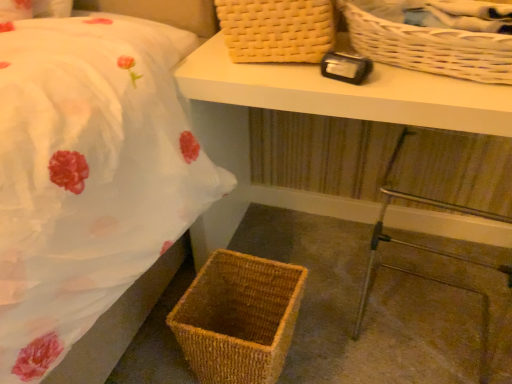
Question: Does woven wicker basket at lower left have a lesser width compared to woven wood table at center?

Choices:
 (A) yes
 (B) no

Answer: (B)

Question: Is woven wicker basket at lower left outside woven wood table at center?

Choices:
 (A) yes
 (B) no

Answer: (A)

Question: Is woven wicker basket at lower left taller than woven wood table at center?

Choices:
 (A) yes
 (B) no

Answer: (B)

Question: Is woven wicker basket at lower left bigger than woven wood table at center?

Choices:
 (A) no
 (B) yes

Answer: (A)

Question: Considering the relative sizes of woven wicker basket at lower left and woven wood table at center in the image provided, is woven wicker basket at lower left smaller than woven wood table at center?

Choices:
 (A) yes
 (B) no

Answer: (A)

Question: Is woven wood table at center located within woven wicker basket at lower left?

Choices:
 (A) yes
 (B) no

Answer: (B)

Question: Is woven beige picnic basket at upper center, which appears as the third picnic basket when ordered from the bottom, surrounded by metallic silver step stool at lower right?

Choices:
 (A) no
 (B) yes

Answer: (A)

Question: From the image's perspective, is metallic silver step stool at lower right over woven beige picnic basket at upper center, which appears as the third picnic basket when ordered from the bottom?

Choices:
 (A) no
 (B) yes

Answer: (A)

Question: Is metallic silver step stool at lower right to the left of woven beige picnic basket at upper center, arranged as the first picnic basket when viewed from the top, from the viewer's perspective?

Choices:
 (A) yes
 (B) no

Answer: (B)

Question: Is metallic silver step stool at lower right facing towards woven beige picnic basket at upper center, arranged as the first picnic basket when viewed from the top?

Choices:
 (A) yes
 (B) no

Answer: (B)

Question: Is the position of metallic silver step stool at lower right less distant than that of woven beige picnic basket at upper center, arranged as the first picnic basket when viewed from the top?

Choices:
 (A) no
 (B) yes

Answer: (B)

Question: Is metallic silver step stool at lower right bigger than woven beige picnic basket at upper center, arranged as the first picnic basket when viewed from the top?

Choices:
 (A) no
 (B) yes

Answer: (B)

Question: Is metallic silver step stool at lower right shorter than brown woven picnic basket at lower left, the 3th picnic basket positioned from the top?

Choices:
 (A) yes
 (B) no

Answer: (B)